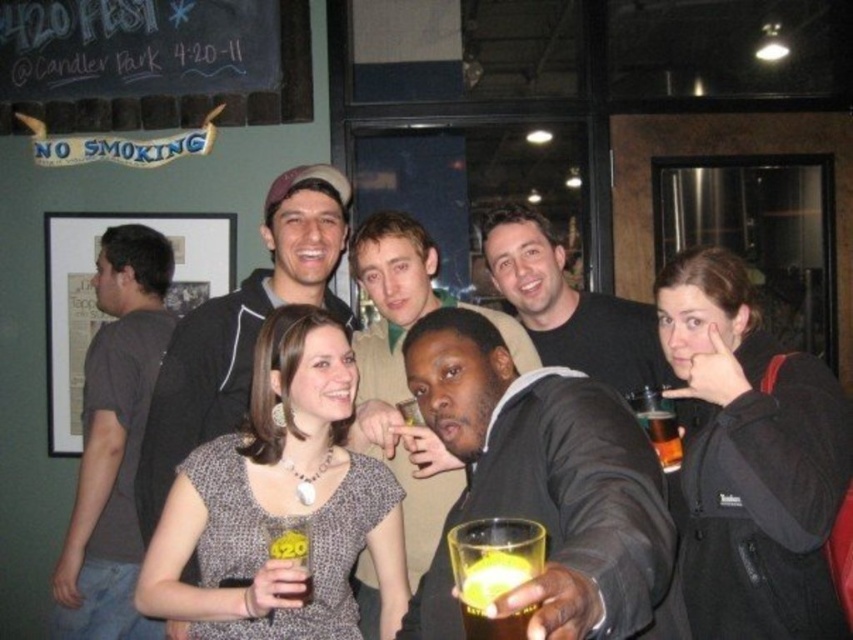
Question: Is gray cotton t-shirt at left to the left of smooth black jacket at center from the viewer's perspective?

Choices:
 (A) no
 (B) yes

Answer: (B)

Question: Is gray cotton t-shirt at left bigger than translucent plastic cup at center?

Choices:
 (A) no
 (B) yes

Answer: (B)

Question: Which point is farther from the camera taking this photo?

Choices:
 (A) (408, 406)
 (B) (674, 465)
 (C) (456, 636)

Answer: (A)

Question: Can you confirm if matte black hoodie at upper center is smaller than black matte jacket at upper center?

Choices:
 (A) no
 (B) yes

Answer: (A)

Question: Which object is positioned farthest from the translucent plastic cup at lower right?

Choices:
 (A) black matte jacket at upper center
 (B) translucent yellow liquid at lower center
 (C) smooth black suit at center

Answer: (B)

Question: Considering the real-world distances, which object is farthest from the gray cotton t-shirt at left?

Choices:
 (A) smooth black suit at center
 (B) smooth black jacket at center

Answer: (A)